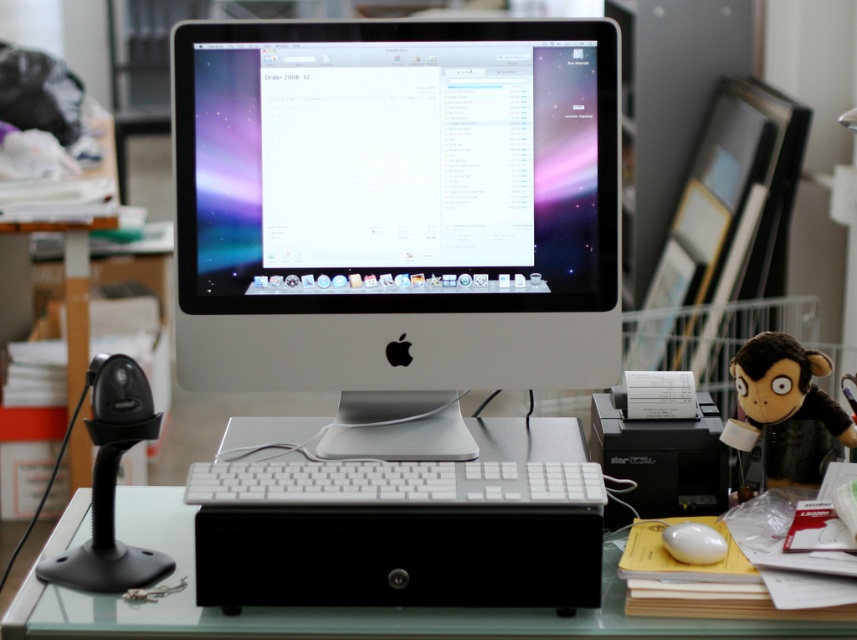
Question: Can you confirm if clear glass table at center is positioned above white matte mouse at lower right?

Choices:
 (A) no
 (B) yes

Answer: (A)

Question: Is clear glass table at center below white matte mouse at lower right?

Choices:
 (A) yes
 (B) no

Answer: (A)

Question: Among these objects, which one is farthest from the camera?

Choices:
 (A) white plastic monitor at center
 (B) white matte keyboard at center
 (C) brown plush monkey at right
 (D) clear glass table at center

Answer: (C)

Question: Which object appears closest to the camera in this image?

Choices:
 (A) brown plush monkey at right
 (B) white plastic keyboard at center
 (C) white matte keyboard at center
 (D) clear glass table at center

Answer: (D)

Question: Which object is closer to the camera taking this photo?

Choices:
 (A) white plastic monitor at center
 (B) brown plush monkey at right
 (C) white plastic keyboard at center

Answer: (C)

Question: Is white plastic keyboard at center to the left of clear glass table at center from the viewer's perspective?

Choices:
 (A) yes
 (B) no

Answer: (A)